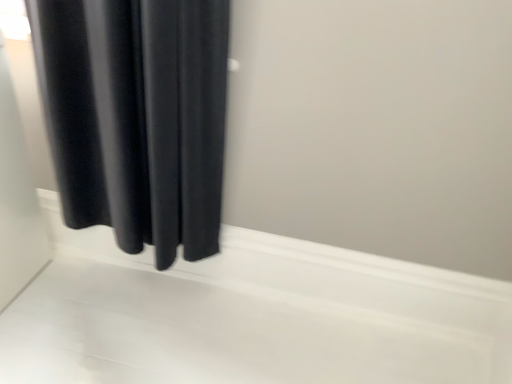
In order to face black velvet curtain at left, should I rotate leftwards or rightwards?

Turn left approximately 18.234 degrees to face it.

What do you see at coordinates (137, 117) in the screenshot?
I see `black velvet curtain at left` at bounding box center [137, 117].

The image size is (512, 384). I want to click on black velvet curtain at left, so click(137, 117).

The height and width of the screenshot is (384, 512). I want to click on black velvet curtain at left, so 137,117.